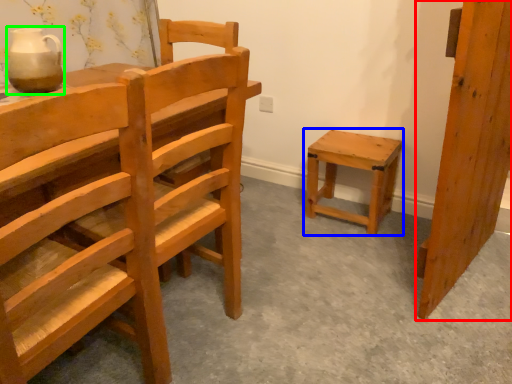
Question: Which object is positioned closest to wood (highlighted by a red box)? Select from stool (highlighted by a blue box) and pottery (highlighted by a green box).

Choices:
 (A) stool
 (B) pottery

Answer: (A)